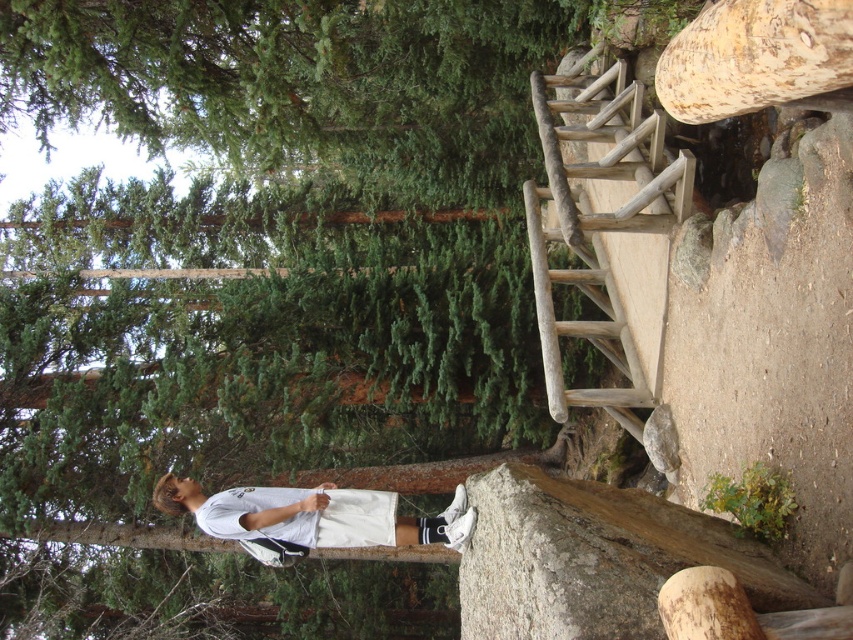
Question: Does natural wood ladder at upper right appear over white matte shorts at lower center?

Choices:
 (A) yes
 (B) no

Answer: (A)

Question: Which point is closer to the camera?

Choices:
 (A) natural wood ladder at upper right
 (B) green matte tree trunk at center

Answer: (B)

Question: Which object is farther from the camera taking this photo?

Choices:
 (A) natural wood ladder at upper right
 (B) white matte shorts at lower center
 (C) green matte tree trunk at center

Answer: (A)

Question: Which object is positioned closest to the green matte tree trunk at center?

Choices:
 (A) natural wood ladder at upper right
 (B) white matte shorts at lower center

Answer: (A)

Question: Is natural wood ladder at upper right thinner than white matte shorts at lower center?

Choices:
 (A) yes
 (B) no

Answer: (A)

Question: Can you confirm if green matte tree trunk at center is bigger than natural wood ladder at upper right?

Choices:
 (A) yes
 (B) no

Answer: (A)